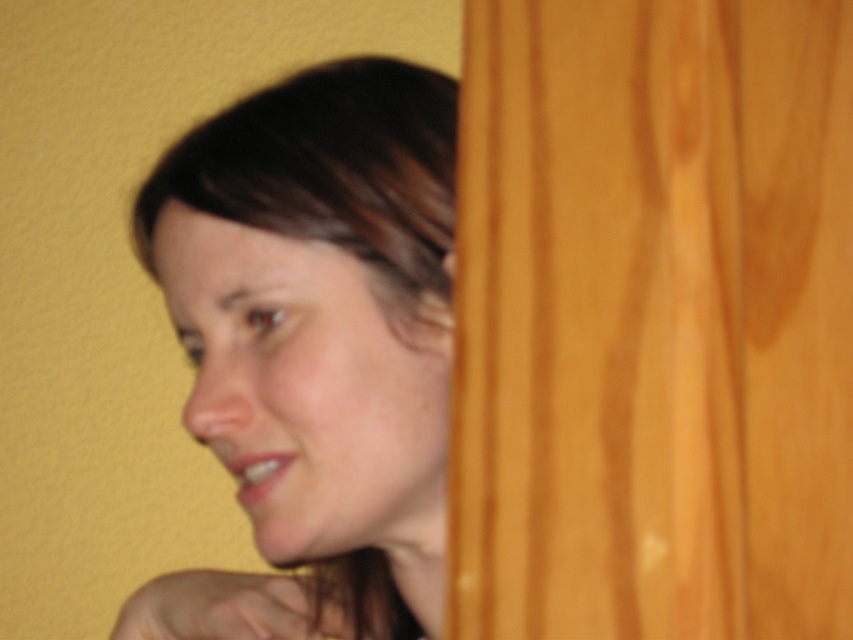
You are designing a portrait and want to ensure the matte skin face at center and dark brown hair at upper left are proportionate. Based on the scene, which object has a greater width?

The matte skin face at center has a greater width than the dark brown hair at upper left.